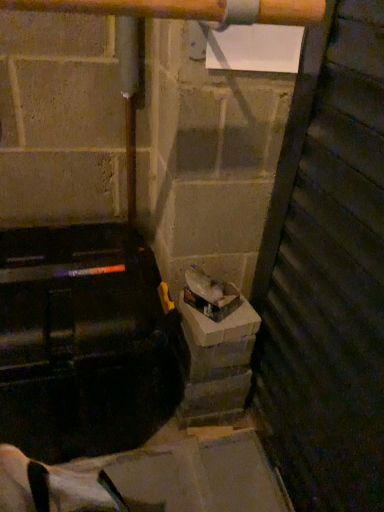
Question: From the image's perspective, is wooden door at right above or below shiny plastic bag at center?

Choices:
 (A) below
 (B) above

Answer: (A)

Question: Is wooden door at right spatially inside shiny plastic bag at center, or outside of it?

Choices:
 (A) outside
 (B) inside

Answer: (A)

Question: Which is farther from the wooden door at right?

Choices:
 (A) concreteroughconcrete block at center
 (B) shiny plastic bag at center

Answer: (B)

Question: Estimate the real-world distances between objects in this image. Which object is closer to the wooden door at right?

Choices:
 (A) concreteroughconcrete block at center
 (B) shiny plastic bag at center

Answer: (A)